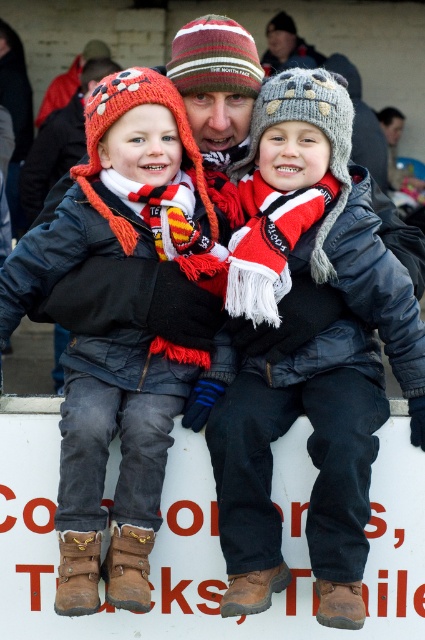
You are a photographer taking a picture of the scene. You notice two points marked in the image at coordinates point (385, 284) and point (130, 410). Which point is closer to your camera lens?

Point (130, 410) is closer to the camera lens because it is less further than point (385, 284).

You are trying to decide which item to pack first for a cold day based on their sizes. According to the image, which item is bigger between the matte black jacket at center and the knitted woolen hat at center?

The matte black jacket at center is larger in size than the knitted woolen hat at center, so you should pack the matte black jacket at center first as it takes up more space.